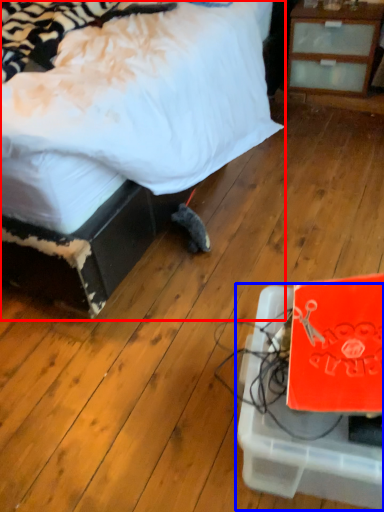
Question: Which object appears closest to the camera in this image, bed (highlighted by a red box) or cardboard box (highlighted by a blue box)?

Choices:
 (A) bed
 (B) cardboard box

Answer: (B)